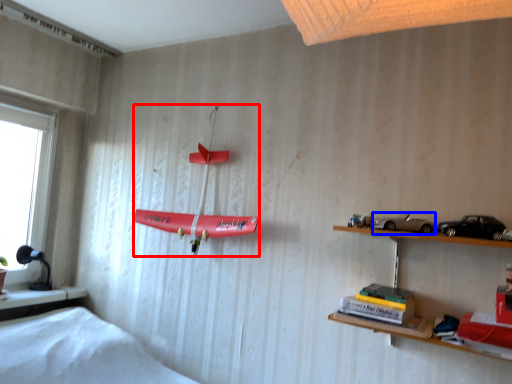
Question: Which point is closer to the camera, toy (highlighted by a red box) or toy car (highlighted by a blue box)?

Choices:
 (A) toy
 (B) toy car

Answer: (B)